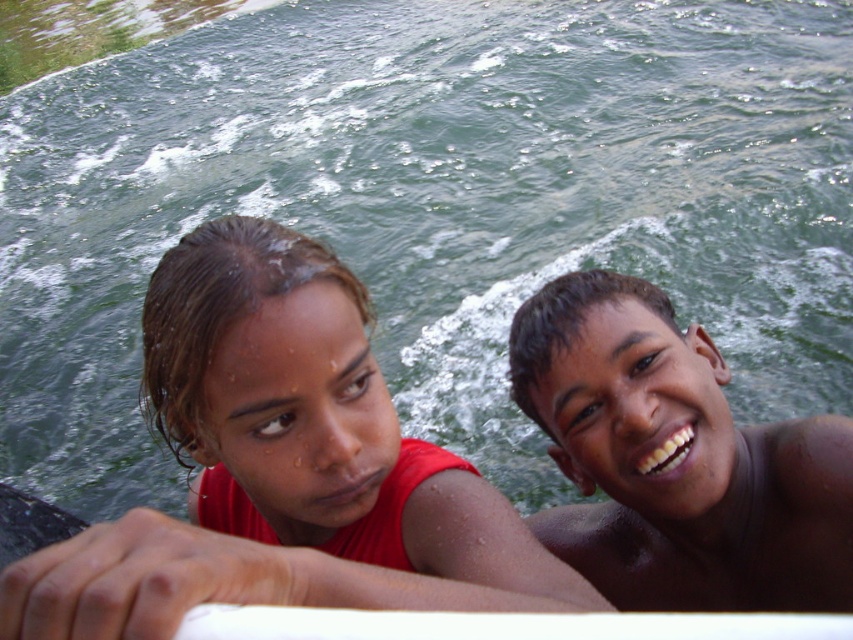
Can you confirm if matte red shirt at center is positioned to the left of brown shiny skin at upper right?

Correct, you'll find matte red shirt at center to the left of brown shiny skin at upper right.

Can you confirm if matte red shirt at center is positioned to the right of brown shiny skin at upper right?

Incorrect, matte red shirt at center is not on the right side of brown shiny skin at upper right.

What do you see at coordinates (282, 467) in the screenshot?
I see `matte red shirt at center` at bounding box center [282, 467].

The image size is (853, 640). What are the coordinates of `matte red shirt at center` in the screenshot? It's located at (282, 467).